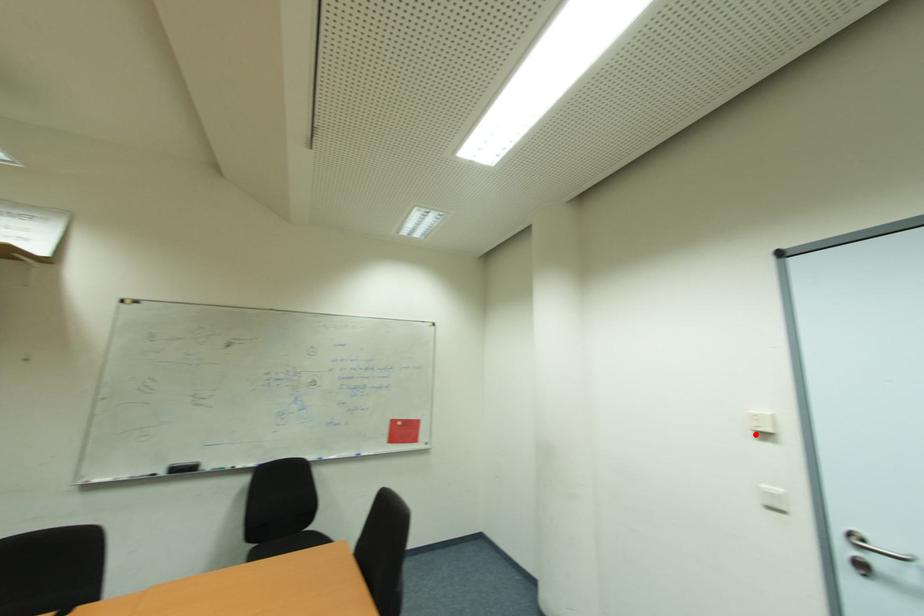
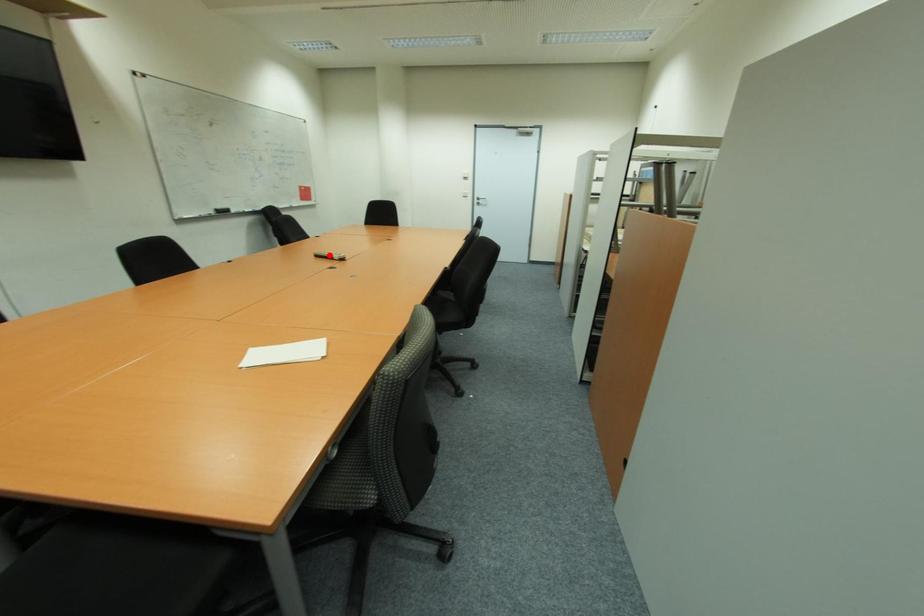
I am providing you with two images of the same scene from different viewpoints. A red point is marked on the first image and another point is marked on the second image. Is the marked point in image1 the same physical position as the marked point in image2?

No